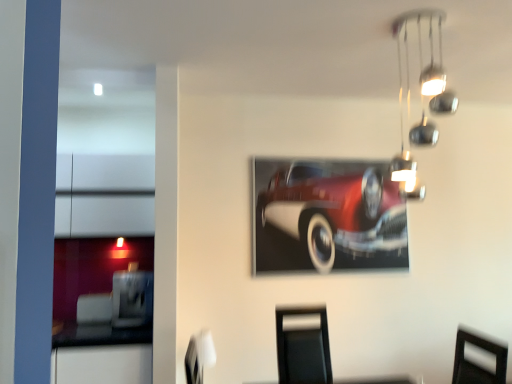
Where is `vacant point above shiny red car at center (from a real-world perspective)`? vacant point above shiny red car at center (from a real-world perspective) is located at coordinates (337, 152).